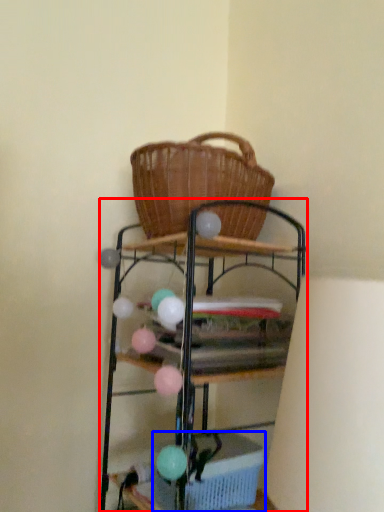
Question: Which of the following is the closest to the observer, shelf (highlighted by a red box) or basket (highlighted by a blue box)?

Choices:
 (A) shelf
 (B) basket

Answer: (A)